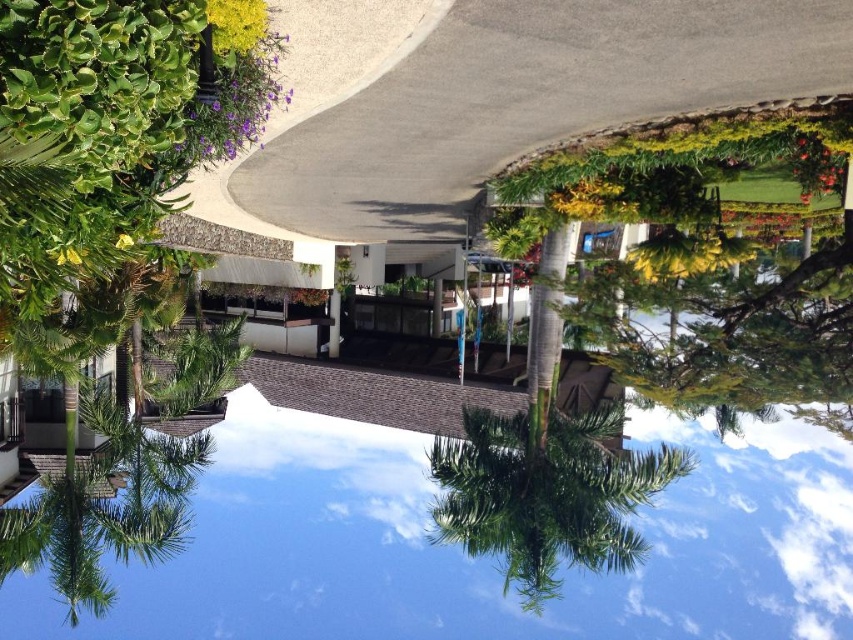
Question: Among these points, which one is farthest from the camera?

Choices:
 (A) (515, 541)
 (B) (677, 540)

Answer: (B)

Question: Which point is closer to the camera taking this photo?

Choices:
 (A) coord(332,524)
 (B) coord(488,456)

Answer: (B)

Question: In this image, where is transparent glass pool at center located relative to green leafy palm tree at center?

Choices:
 (A) below
 (B) above

Answer: (A)

Question: Is transparent glass pool at center smaller than green leafy palm tree at center?

Choices:
 (A) no
 (B) yes

Answer: (A)

Question: Is transparent glass pool at center to the right of green leafy palm tree at center from the viewer's perspective?

Choices:
 (A) yes
 (B) no

Answer: (A)